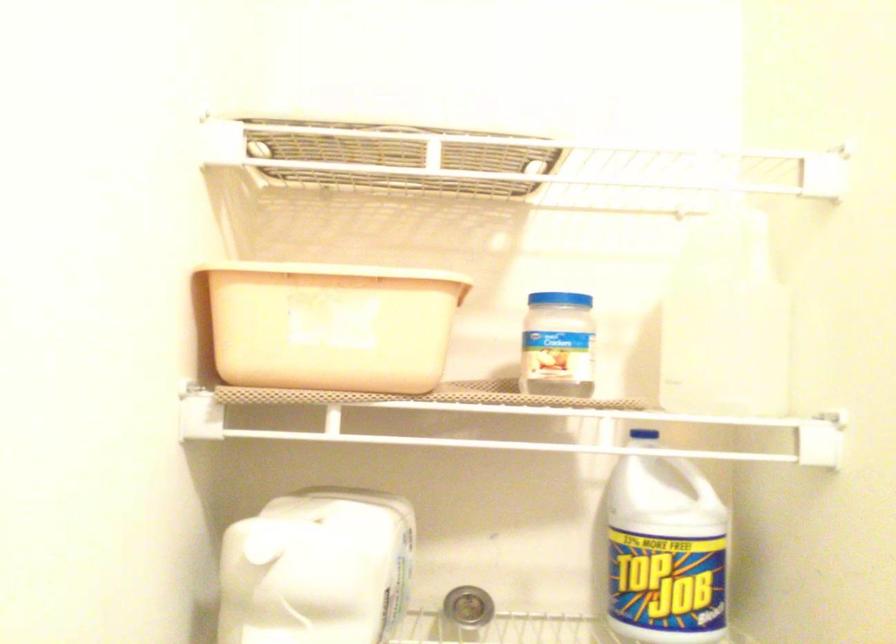
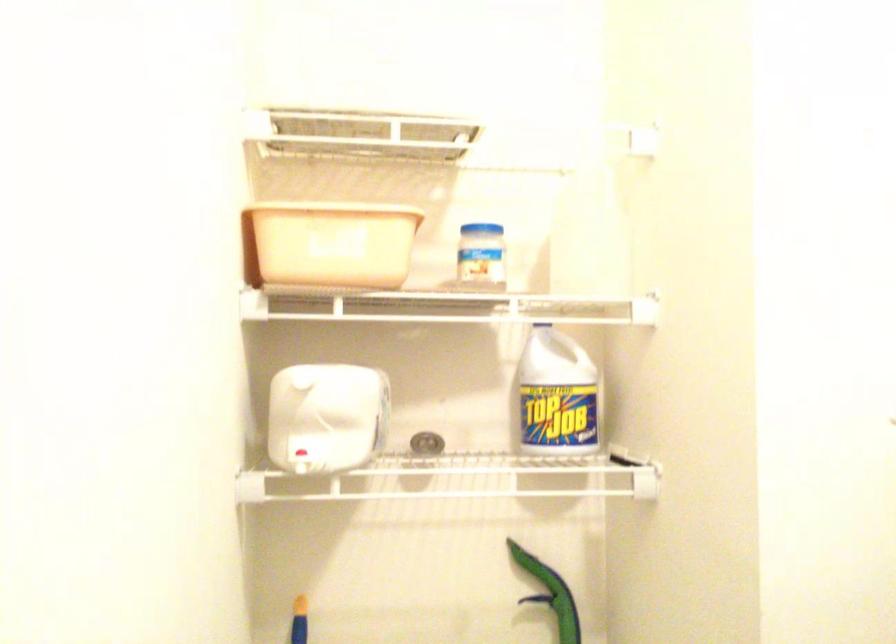
Find the pixel in the second image that matches (664,552) in the first image.

(556, 395)